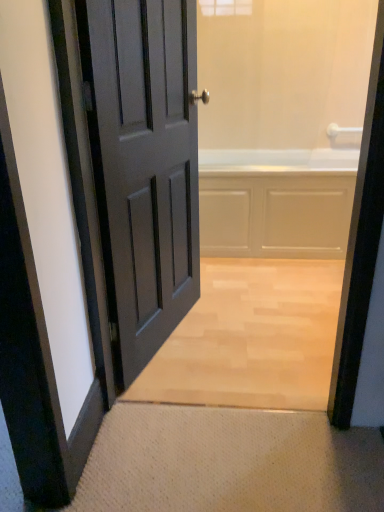
Question: Looking at the image, does white glossy bathtub at center seem bigger or smaller compared to white textured mat at lower center?

Choices:
 (A) big
 (B) small

Answer: (A)

Question: Do you think white glossy bathtub at center is within white textured mat at lower center, or outside of it?

Choices:
 (A) outside
 (B) inside

Answer: (A)

Question: Which is farther from the white textured mat at lower center?

Choices:
 (A) white glossy bathtub at center
 (B) matte gray door at left

Answer: (A)

Question: Which object is the closest to the white glossy bathtub at center?

Choices:
 (A) matte gray door at left
 (B) white textured mat at lower center

Answer: (A)